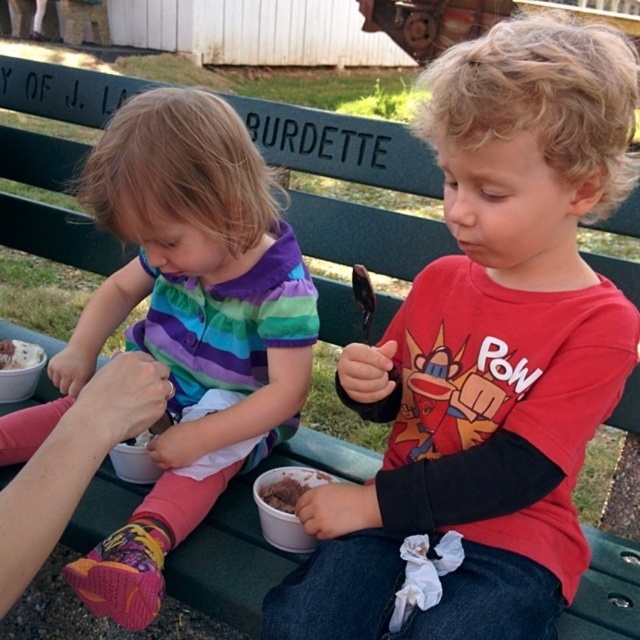
You are a photographer trying to capture a closeup of the multicolored striped shirt at center and the chocolate ice cream at lower center. Since you want both subjects to be in focus, which one should you focus on first considering their sizes?

The multicolored striped shirt at center is taller than the chocolate ice cream at lower center, so you should focus on the multicolored striped shirt at center first as it is larger and will require more attention to detail.

You are a parent trying to ensure your children are sitting safely on the bench. The recommended minimum distance between two children eating ice cream is 24 inches to prevent spills. Based on the scene, is the distance between the chocolate ice cream at lower center and the white matte ice cream at lower left sufficient?

The distance between the chocolate ice cream at lower center and the white matte ice cream at lower left is 28.11 inches, which exceeds the recommended 24 inches. Therefore, the spacing is sufficient to prevent spills.